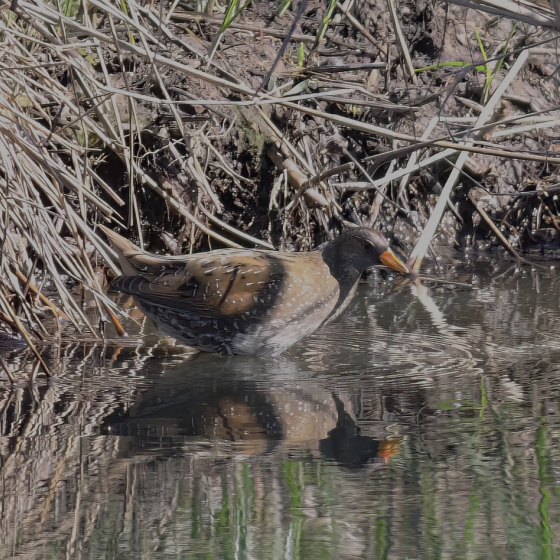
Identify the location of reflection of green plant. This screenshot has width=560, height=560. (247, 501), (298, 480), (543, 487).